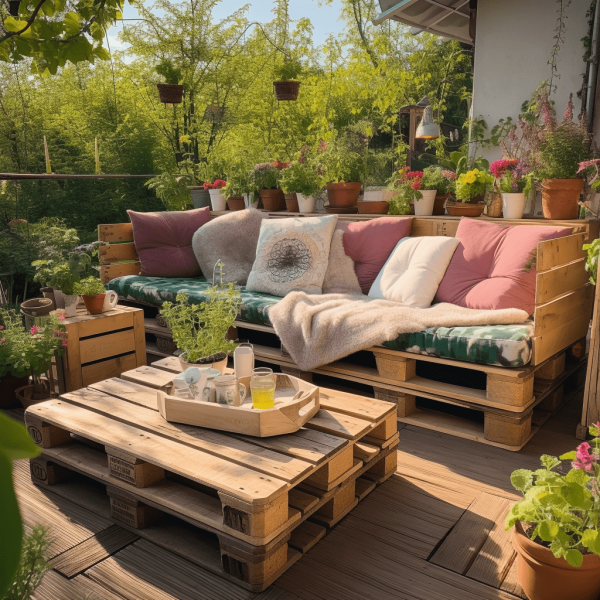
You are a GUI agent. You are given a task and a screenshot of the screen. Output one action in this format:
    pyautogui.click(x=<x>, y=<y>)
    Task: Click on the wooden pallet table
    This screenshot has height=600, width=600.
    Given the screenshot: What is the action you would take?
    pyautogui.click(x=223, y=472)